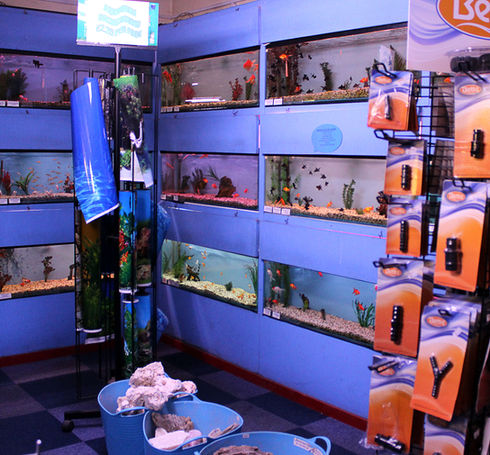
I want to click on shelf for product display, so click(x=422, y=103).